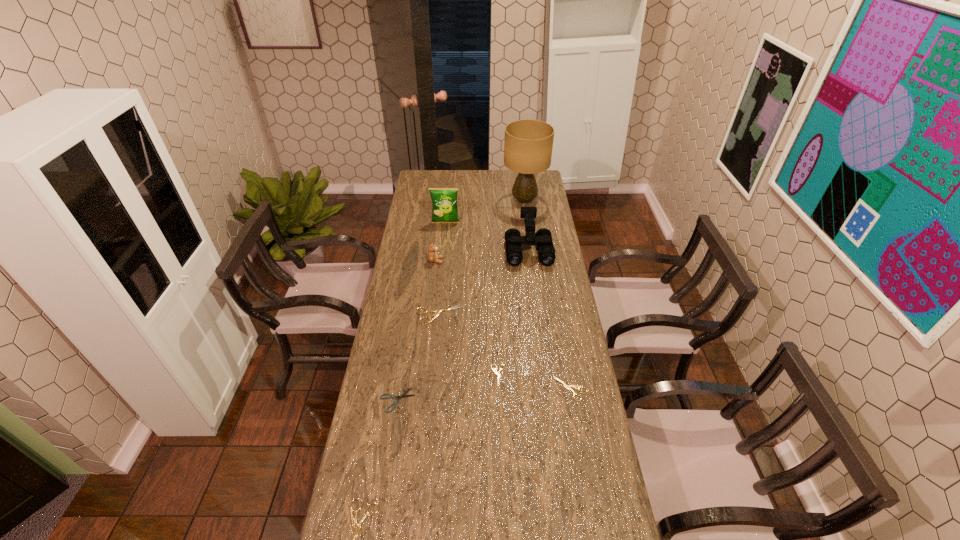
I want to click on vacant space located on the right of the black shears, so click(518, 400).

Find the location of a particular element. The width and height of the screenshot is (960, 540). object present at the far edge is located at coordinates (528, 144).

The width and height of the screenshot is (960, 540). I want to click on crisp (potato chip) at the left edge, so click(444, 200).

Locate an element on the screen. The width and height of the screenshot is (960, 540). teddy bear that is positioned at the left edge is located at coordinates tap(433, 257).

Find the location of `lampshade present at the right edge`. lampshade present at the right edge is located at coordinates (528, 144).

Locate an element on the screen. The image size is (960, 540). binoculars that is at the right edge is located at coordinates (543, 238).

In order to click on shears at the right edge in this screenshot , I will do `click(569, 387)`.

The image size is (960, 540). I want to click on object present at the far right corner, so click(x=528, y=144).

Where is `blank space at the far edge`? This screenshot has height=540, width=960. blank space at the far edge is located at coordinates (491, 186).

In the image, there is a desktop. At what (x,y) coordinates should I click in order to perform the action: click on free space at the left edge. Please return your answer as a coordinate pair (x, y). Looking at the image, I should click on (415, 353).